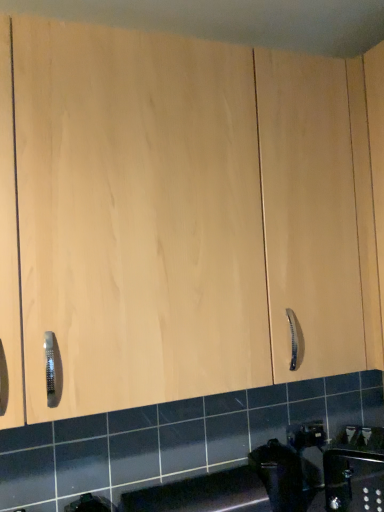
Question: From a real-world perspective, is black plastic trash can at lower center positioned above or below satin nickel faucet at lower right?

Choices:
 (A) above
 (B) below

Answer: (A)

Question: Is black plastic trash can at lower center situated inside satin nickel faucet at lower right or outside?

Choices:
 (A) inside
 (B) outside

Answer: (B)

Question: Is black plastic trash can at lower center taller or shorter than satin nickel faucet at lower right?

Choices:
 (A) tall
 (B) short

Answer: (A)

Question: Visually, is satin nickel faucet at lower right positioned to the left or to the right of black plastic trash can at lower center?

Choices:
 (A) right
 (B) left

Answer: (A)

Question: Does point (350, 494) appear closer or farther from the camera than point (289, 488)?

Choices:
 (A) farther
 (B) closer

Answer: (A)

Question: From a real-world perspective, is satin nickel faucet at lower right positioned above or below black plastic trash can at lower center?

Choices:
 (A) above
 (B) below

Answer: (B)

Question: Is satin nickel faucet at lower right spatially inside black plastic trash can at lower center, or outside of it?

Choices:
 (A) inside
 (B) outside

Answer: (B)